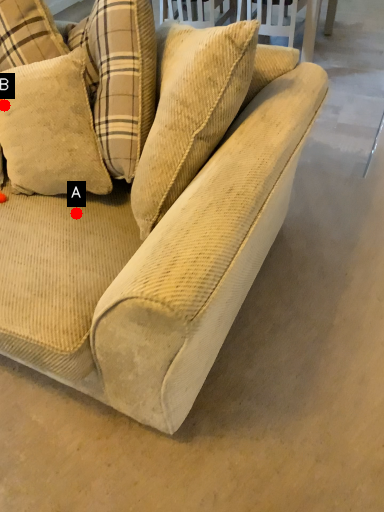
Question: Two points are circled on the image, labeled by A and B beside each circle. Which point is closer to the camera?

Choices:
 (A) A is closer
 (B) B is closer

Answer: (B)